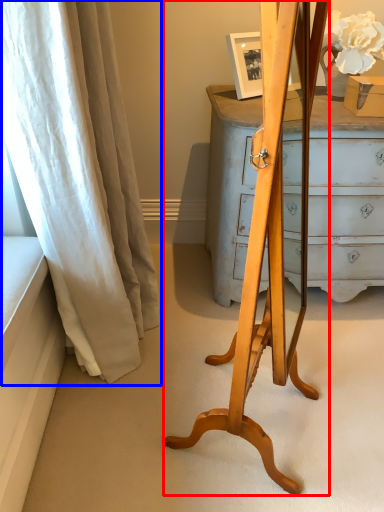
Question: Which of the following is the closest to the observer, easel (highlighted by a red box) or curtain (highlighted by a blue box)?

Choices:
 (A) easel
 (B) curtain

Answer: (A)